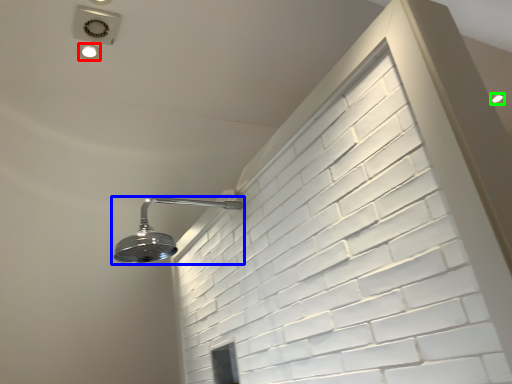
Question: Considering the real-world distances, which object is closest to droplight (highlighted by a red box)? shower (highlighted by a blue box) or droplight (highlighted by a green box).

Choices:
 (A) shower
 (B) droplight

Answer: (A)